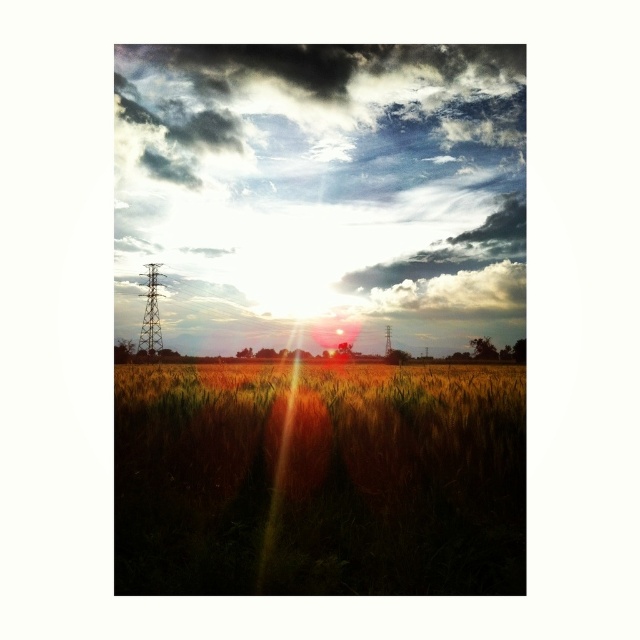
You are a photographer standing in the field and want to take a photo of the golden grass at center without the cloudy sky at upper center blocking the view. Is it possible to do so by adjusting your position or angle?

The golden grass at center is behind the cloudy sky at upper center, so you cannot take a photo of the golden grass at center without the cloudy sky at upper center blocking the view because the cloudy sky is in front of it.

You are a photographer trying to capture the cloudy sky at upper center and the golden grass at center in a single shot. Given that your camera can only focus on one object at a time, which object should you prioritize focusing on to ensure the other remains in acceptable sharpness?

The cloudy sky at upper center has a larger size compared to golden grass at center, so focusing on the cloudy sky at upper center would likely keep the golden grass at center in acceptable sharpness due to its smaller size and distance from the camera.